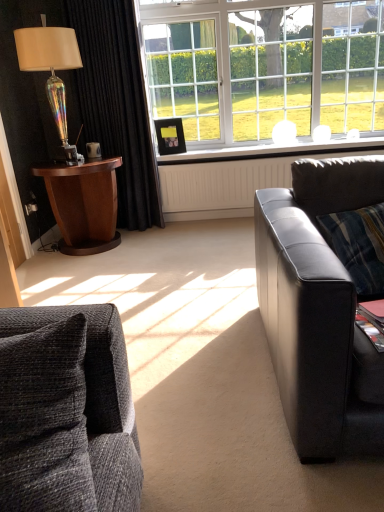
Question: Can you confirm if wooden picture frame at upper center is bigger than iridescent glass lamp at left?

Choices:
 (A) no
 (B) yes

Answer: (A)

Question: Does wooden picture frame at upper center come behind iridescent glass lamp at left?

Choices:
 (A) yes
 (B) no

Answer: (A)

Question: Can you confirm if wooden picture frame at upper center is taller than iridescent glass lamp at left?

Choices:
 (A) no
 (B) yes

Answer: (A)

Question: Could you tell me if wooden picture frame at upper center is facing iridescent glass lamp at left?

Choices:
 (A) no
 (B) yes

Answer: (A)

Question: From a real-world perspective, is wooden picture frame at upper center on iridescent glass lamp at left?

Choices:
 (A) yes
 (B) no

Answer: (B)

Question: Is wooden picture frame at upper center to the right of iridescent glass lamp at left from the viewer's perspective?

Choices:
 (A) yes
 (B) no

Answer: (A)

Question: Considering the relative positions of wooden picture frame at upper center and black leather couch at right, which appears as the second studio couch when viewed from the left, in the image provided, is wooden picture frame at upper center to the left of black leather couch at right, which appears as the second studio couch when viewed from the left, from the viewer's perspective?

Choices:
 (A) no
 (B) yes

Answer: (B)

Question: Can you confirm if wooden picture frame at upper center is bigger than black leather couch at right, which appears as the second studio couch when viewed from the left?

Choices:
 (A) yes
 (B) no

Answer: (B)

Question: Is wooden picture frame at upper center looking in the opposite direction of black leather couch at right, which appears as the second studio couch when viewed from the left?

Choices:
 (A) no
 (B) yes

Answer: (A)

Question: From a real-world perspective, is wooden picture frame at upper center positioned under black leather couch at right, which appears as the second studio couch when viewed from the left, based on gravity?

Choices:
 (A) no
 (B) yes

Answer: (A)

Question: Is the surface of wooden picture frame at upper center in direct contact with black leather couch at right, which is counted as the second studio couch, starting from the front?

Choices:
 (A) yes
 (B) no

Answer: (B)

Question: Does wooden picture frame at upper center appear on the right side of black leather couch at right, arranged as the 1th studio couch when viewed from the back?

Choices:
 (A) yes
 (B) no

Answer: (B)

Question: From a real-world perspective, is white plastic window sill at center located higher than black velvet curtain at left?

Choices:
 (A) no
 (B) yes

Answer: (A)